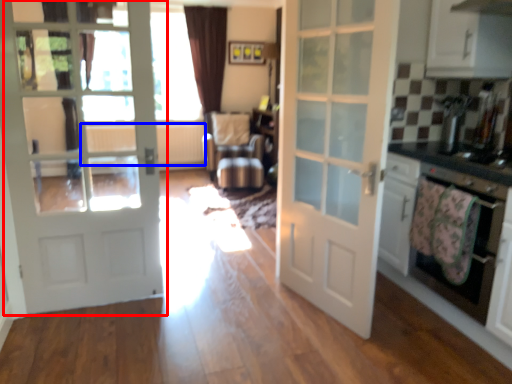
Question: Which object appears farthest to the camera in this image, door (highlighted by a red box) or radiator (highlighted by a blue box)?

Choices:
 (A) door
 (B) radiator

Answer: (B)